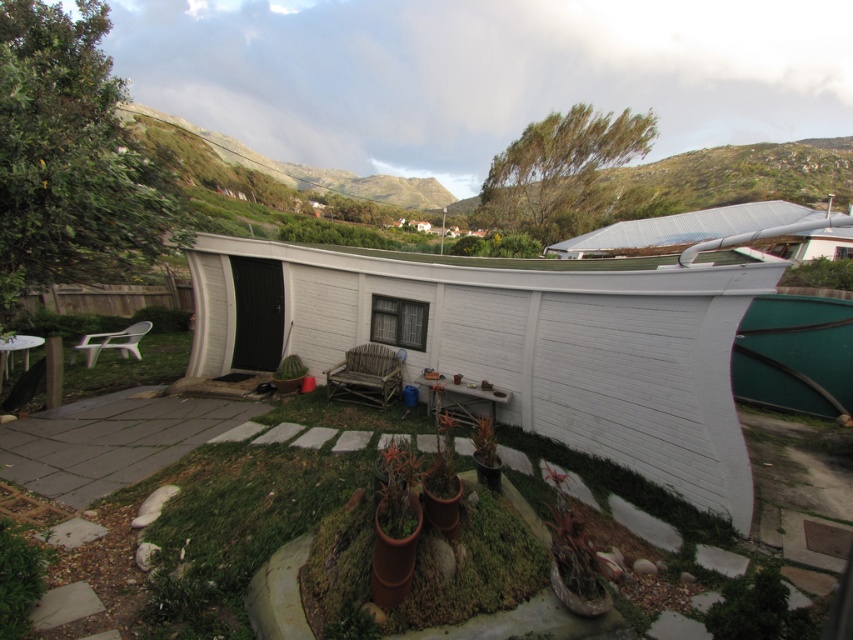
You are planning to build a small garden shed on your property. You have a white wood hut at center and a green grassy hillside at upper center in the image. Which area would be more suitable for placing a larger shed, and why?

The green grassy hillside at upper center would be more suitable for placing a larger shed because it occupies more space than the white wood hut at center, as indicated by the description.

You are standing at the entrance of the curved white structure and want to walk towards the green grassy hillside at upper center. Which direction should you face to head directly towards it?

Since the green grassy hillside at upper center is located at point 0.272 on the x axis and 0.875 on the y axis, you should face towards the upper left direction to head directly towards it.